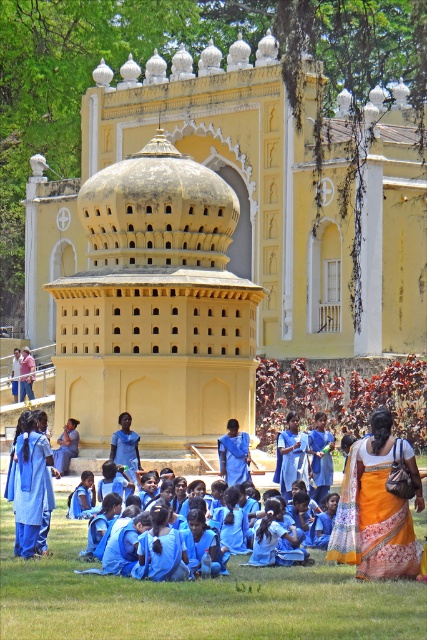
Question: Observing the image, what is the correct spatial positioning of yellow matte palace at center in reference to orange printed sari at lower right?

Choices:
 (A) right
 (B) left

Answer: (B)

Question: Which point appears farthest from the camera in this image?

Choices:
 (A) (114, 449)
 (B) (34, 220)
 (C) (356, 573)
 (D) (344, 637)

Answer: (B)

Question: Which of these objects is positioned farthest from the orange printed sari at lower right?

Choices:
 (A) matte blue dress at center
 (B) green grass at lower center

Answer: (A)

Question: Does green grass at lower center appear on the right side of orange printed sari at lower right?

Choices:
 (A) no
 (B) yes

Answer: (A)

Question: Is yellow matte palace at center positioned behind orange printed sari at lower right?

Choices:
 (A) yes
 (B) no

Answer: (A)

Question: Which point appears farthest from the camera in this image?

Choices:
 (A) (350, 472)
 (B) (190, 596)
 (C) (263, 97)
 (D) (131, 436)

Answer: (C)